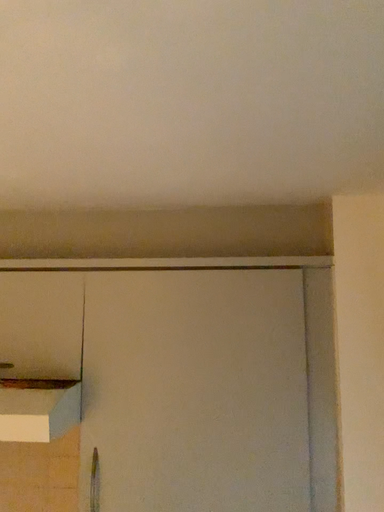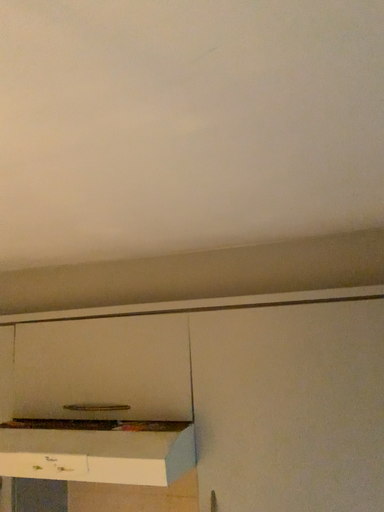
Question: Which way did the camera rotate in the video?

Choices:
 (A) rotated right
 (B) rotated left

Answer: (B)